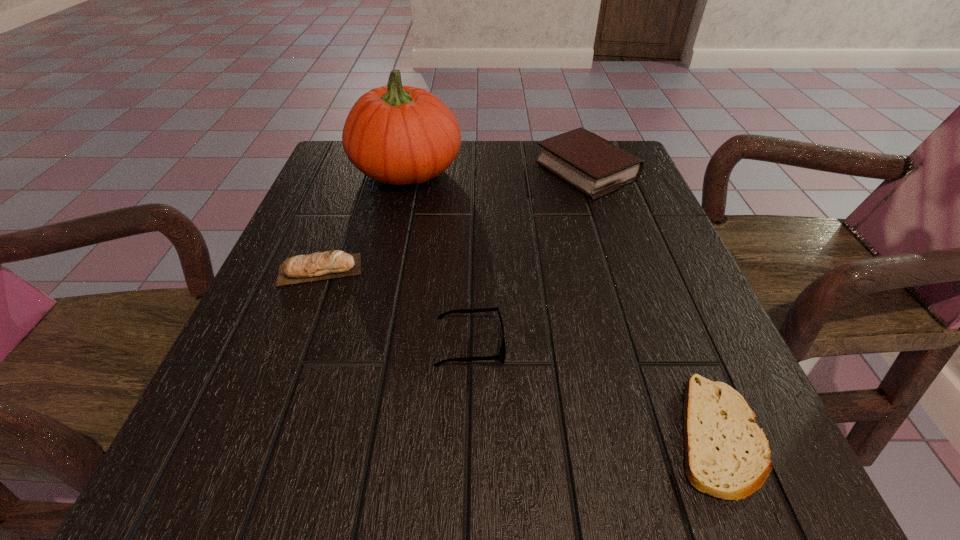
The width and height of the screenshot is (960, 540). What are the coordinates of `vacant region located on the back of the taller pita bread` in the screenshot? It's located at (355, 179).

You are a GUI agent. You are given a task and a screenshot of the screen. Output one action in this format:
    pyautogui.click(x=<x>, y=<y>)
    Task: Click on the free spot located on the back of the nearest object
    
    Given the screenshot: What is the action you would take?
    pyautogui.click(x=645, y=258)

The width and height of the screenshot is (960, 540). I want to click on pumpkin that is at the far edge, so click(400, 135).

This screenshot has width=960, height=540. In order to click on Bible at the far edge in this screenshot , I will do `click(596, 167)`.

Identify the location of object present at the near edge. The height and width of the screenshot is (540, 960). (727, 455).

The width and height of the screenshot is (960, 540). In order to click on pumpkin positioned at the left edge in this screenshot , I will do `click(400, 135)`.

You are a GUI agent. You are given a task and a screenshot of the screen. Output one action in this format:
    pyautogui.click(x=<x>, y=<y>)
    Task: Click on the pita bread that is at the left edge
    The image size is (960, 540).
    Given the screenshot: What is the action you would take?
    pyautogui.click(x=324, y=265)

At what (x,y) coordinates should I click in order to perform the action: click on Bible that is at the right edge. Please return your answer as a coordinate pair (x, y). Looking at the image, I should click on (596, 167).

Locate an element on the screen. The height and width of the screenshot is (540, 960). pita bread positioned at the right edge is located at coordinates (727, 455).

Identify the location of object situated at the far left corner. The width and height of the screenshot is (960, 540). (400, 135).